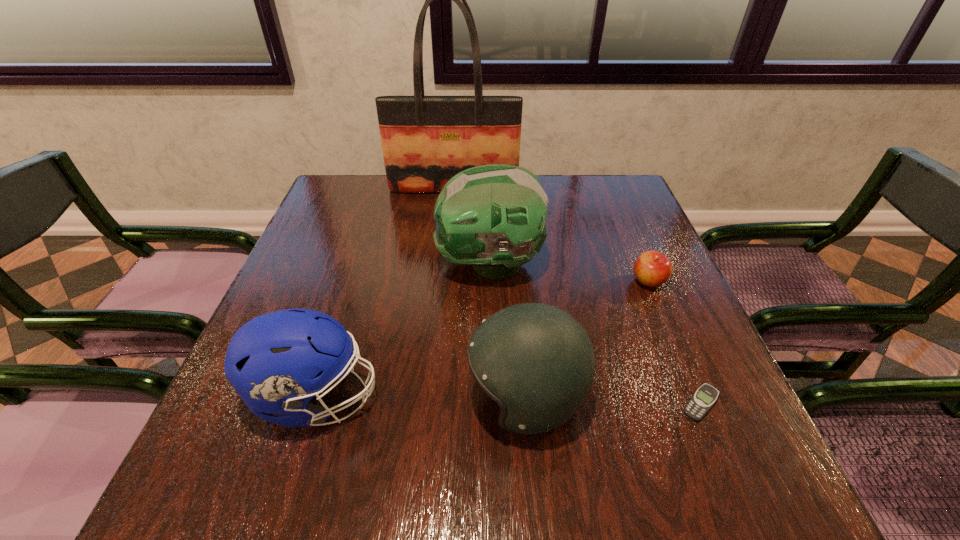
Find the location of a particular element. This screenshot has height=540, width=960. shopping bag is located at coordinates (426, 140).

Locate an element on the screen. the tallest object is located at coordinates (426, 140).

Locate an element on the screen. the farthest football helmet is located at coordinates (493, 216).

The width and height of the screenshot is (960, 540). What are the coordinates of `the second tallest object` in the screenshot? It's located at (493, 216).

Find the location of a particular element. the leftmost football helmet is located at coordinates (273, 361).

Identify the location of the fifth tallest object. (x=652, y=268).

This screenshot has width=960, height=540. Identify the location of the shortest object. (702, 400).

Identify the location of free spot located on the front-facing side of the shopping bag. (451, 210).

This screenshot has height=540, width=960. In order to click on free location located on the visor of the fifth shortest object in this screenshot , I will do `click(300, 264)`.

Find the location of a particular element. free space located on the visor of the fifth shortest object is located at coordinates (312, 264).